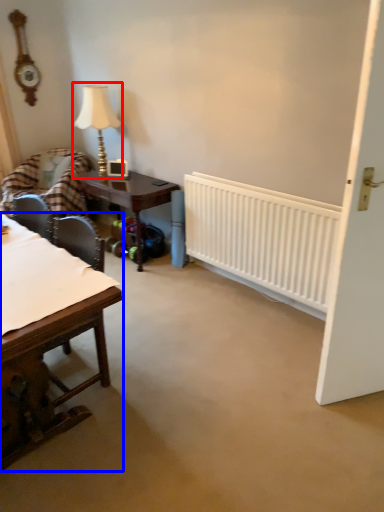
Question: Which point is closer to the camera, table lamp (highlighted by a red box) or table (highlighted by a blue box)?

Choices:
 (A) table lamp
 (B) table

Answer: (B)